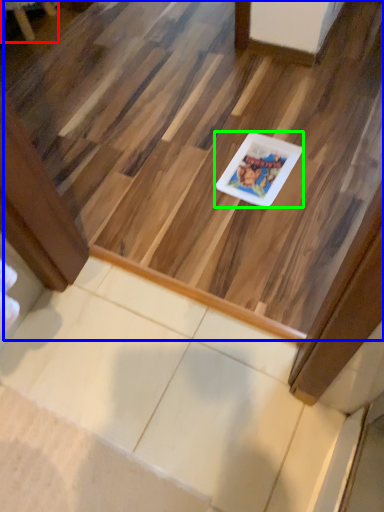
Question: Considering the real-world distances, which object is closest to furniture (highlighted by a red box)? stairwell (highlighted by a blue box) or glass plate (highlighted by a green box).

Choices:
 (A) stairwell
 (B) glass plate

Answer: (A)